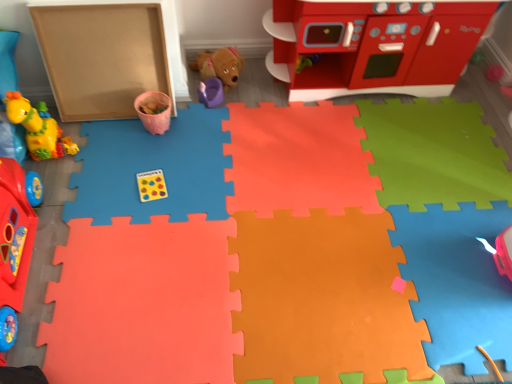
Where is `vacant area that lies between brown plush dog at center, placed as the fifth toy when sorted from left to right, and rubber duck at left, which is the seventh toy from right to left`? Image resolution: width=512 pixels, height=384 pixels. vacant area that lies between brown plush dog at center, placed as the fifth toy when sorted from left to right, and rubber duck at left, which is the seventh toy from right to left is located at coordinates (116, 195).